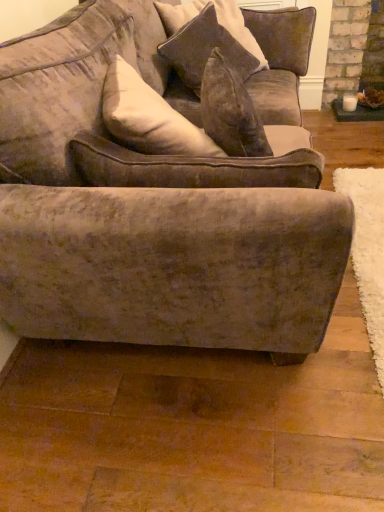
Question: Is the position of velvet cushion at upper center more distant than that of velvet brown couch at center?

Choices:
 (A) yes
 (B) no

Answer: (A)

Question: Does velvet cushion at upper center appear on the right side of velvet brown couch at center?

Choices:
 (A) no
 (B) yes

Answer: (B)

Question: Is velvet cushion at upper center not near velvet brown couch at center?

Choices:
 (A) yes
 (B) no

Answer: (B)

Question: Does velvet cushion at upper center have a larger size compared to velvet brown couch at center?

Choices:
 (A) no
 (B) yes

Answer: (A)

Question: Is velvet cushion at upper center closer to the viewer compared to velvet brown couch at center?

Choices:
 (A) yes
 (B) no

Answer: (B)

Question: Could you tell me if velvet cushion at upper center is facing velvet brown couch at center?

Choices:
 (A) yes
 (B) no

Answer: (A)

Question: Is velvet brown couch at center positioned in front of velvet brown couch at center?

Choices:
 (A) yes
 (B) no

Answer: (A)

Question: Is velvet brown couch at center shorter than velvet brown couch at center?

Choices:
 (A) yes
 (B) no

Answer: (B)

Question: From the image's perspective, would you say velvet brown couch at center is positioned over velvet brown couch at center?

Choices:
 (A) yes
 (B) no

Answer: (A)

Question: Is the surface of velvet brown couch at center in direct contact with velvet brown couch at center?

Choices:
 (A) yes
 (B) no

Answer: (B)

Question: Considering the relative sizes of velvet brown couch at center and velvet brown couch at center in the image provided, is velvet brown couch at center bigger than velvet brown couch at center?

Choices:
 (A) yes
 (B) no

Answer: (A)

Question: Does velvet brown couch at center have a greater height compared to velvet brown couch at center?

Choices:
 (A) no
 (B) yes

Answer: (B)

Question: From a real-world perspective, is velvet brown couch at center physically above velvet cushion at upper center?

Choices:
 (A) yes
 (B) no

Answer: (A)